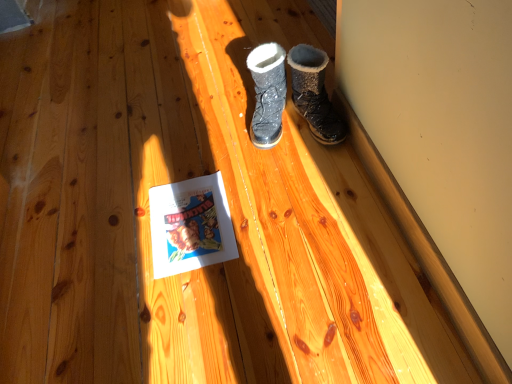
At what (x,y) coordinates should I click in order to perform the action: click on vacant area situated to the left side of sparkly black boot at center, which is the second footwear in right-to-left order. Please return your answer as a coordinate pair (x, y). This screenshot has height=384, width=512. Looking at the image, I should click on (215, 140).